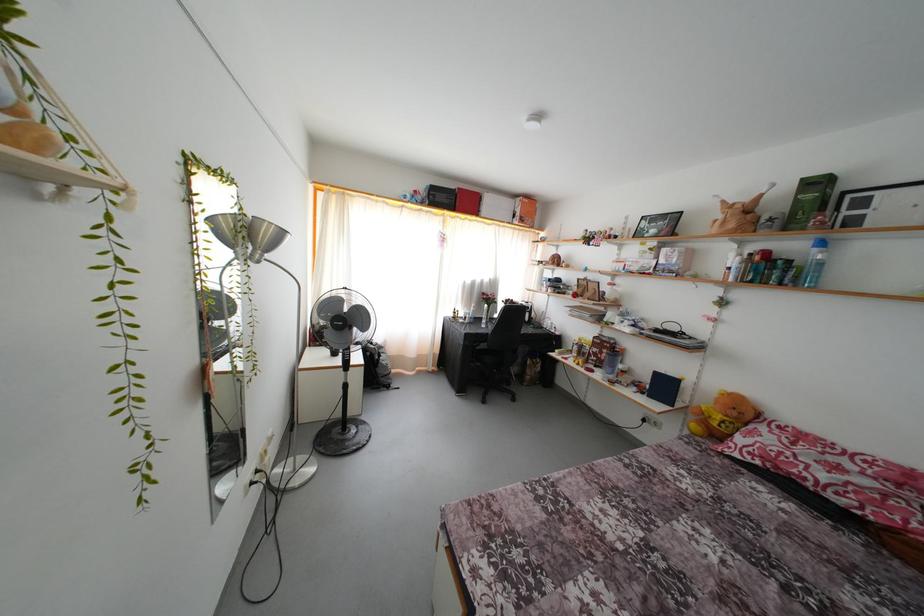
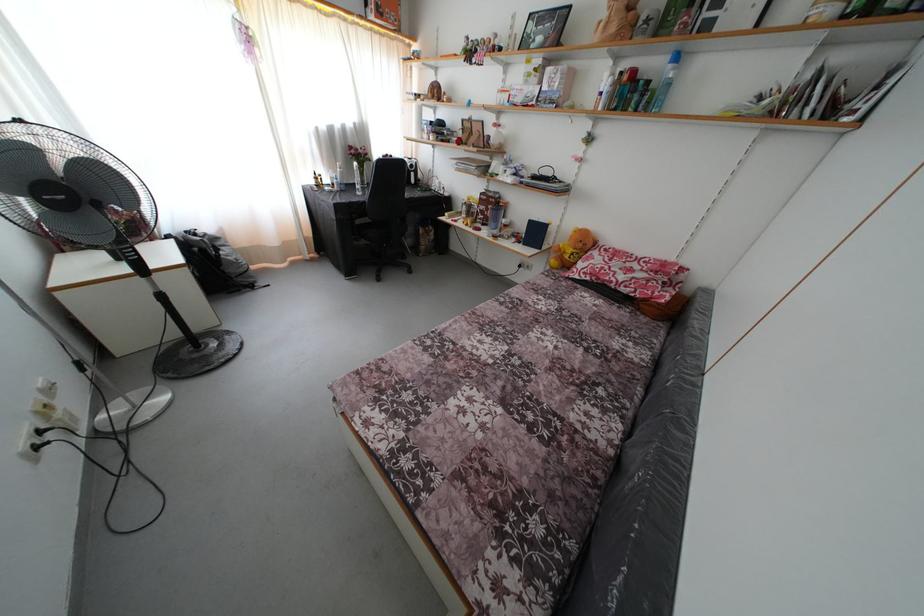
Where in the second image is the point corresponding to [738,419] from the first image?

(585, 251)